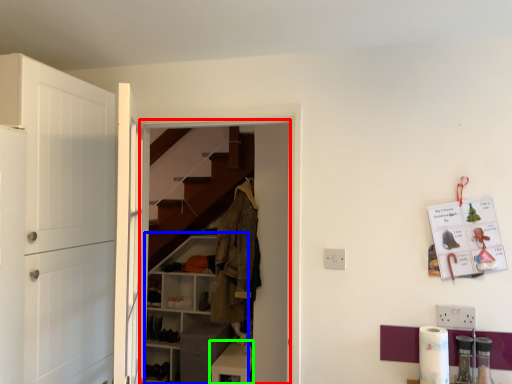
Question: Which object is positioned farthest from closet (highlighted by a red box)? Select from cabinetry (highlighted by a blue box) and cabinetry (highlighted by a green box).

Choices:
 (A) cabinetry
 (B) cabinetry

Answer: (A)